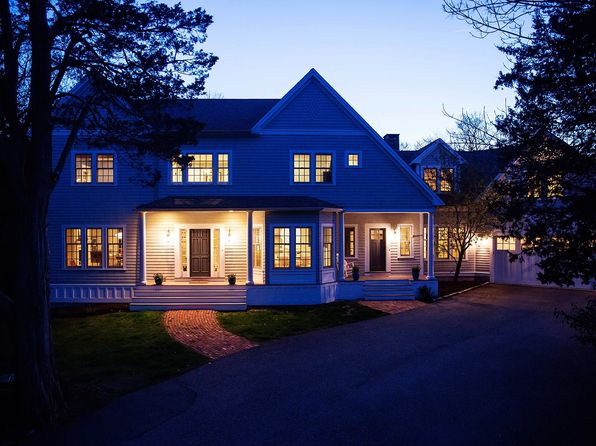
Where is `door`? The width and height of the screenshot is (596, 446). door is located at coordinates (198, 257), (380, 251).